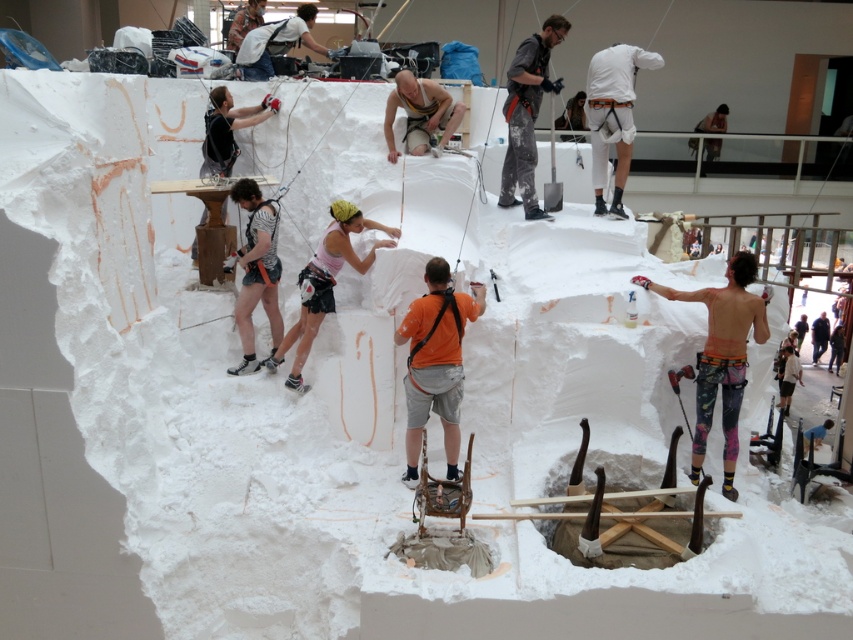
Question: Among these objects, which one is farthest from the camera?

Choices:
 (A) multicolored leggings at right
 (B) pink fabric at center
 (C) white matte backpack at upper center
 (D) orange matte shirt at center

Answer: (C)

Question: Which object is the closest to the striped fabric shorts at center?

Choices:
 (A) multicolored leggings at right
 (B) white matte harness at upper center
 (C) white matte shirt at upper right
 (D) matte yellow harness at center

Answer: (D)

Question: Is striped fabric shorts at center behind matte yellow harness at center?

Choices:
 (A) no
 (B) yes

Answer: (A)

Question: Which point is closer to the camera?

Choices:
 (A) (329, 268)
 (B) (732, 488)
 (C) (292, 44)
 (D) (444, 310)

Answer: (D)

Question: In this image, where is white matte harness at upper center located relative to matte yellow harness at center?

Choices:
 (A) below
 (B) above

Answer: (B)

Question: Is white matte harness at upper center to the right of pink fabric at center from the viewer's perspective?

Choices:
 (A) yes
 (B) no

Answer: (A)